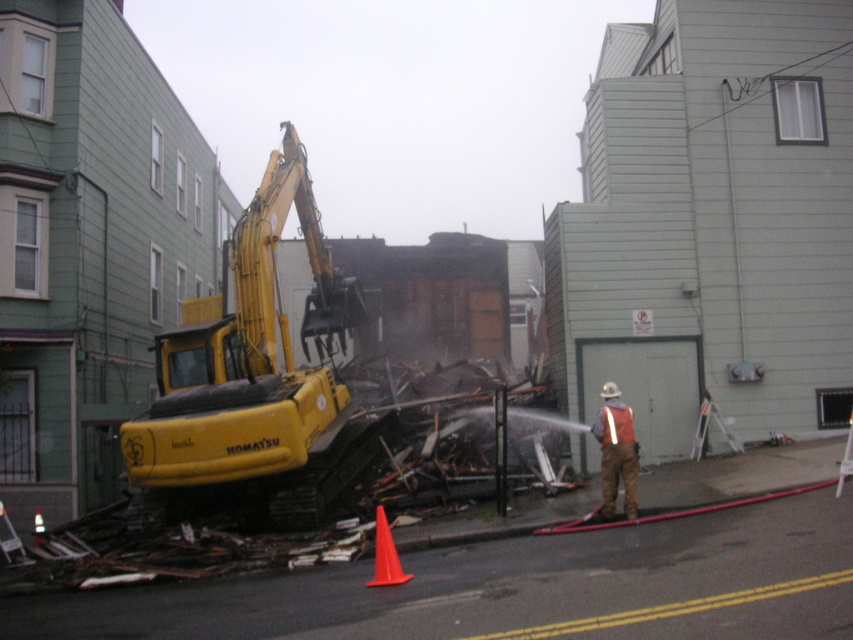
Question: Is yellow rubber excavator at left to the left of orange reflective vest at center from the viewer's perspective?

Choices:
 (A) no
 (B) yes

Answer: (B)

Question: Which of the following is the closest to the observer?

Choices:
 (A) (223, 316)
 (B) (624, 474)

Answer: (B)

Question: Estimate the real-world distances between objects in this image. Which object is farther from the orange plastic cone at lower center?

Choices:
 (A) yellow rubber excavator at left
 (B) orange reflective vest at center

Answer: (A)

Question: Observing the image, what is the correct spatial positioning of orange reflective vest at center in reference to orange plastic cone at lower center?

Choices:
 (A) left
 (B) right

Answer: (B)

Question: Which point is closer to the camera?

Choices:
 (A) orange plastic cone at lower center
 (B) orange reflective vest at center
 (C) yellow rubber excavator at left

Answer: (A)

Question: Can you confirm if yellow rubber excavator at left is thinner than orange plastic cone at lower center?

Choices:
 (A) yes
 (B) no

Answer: (B)